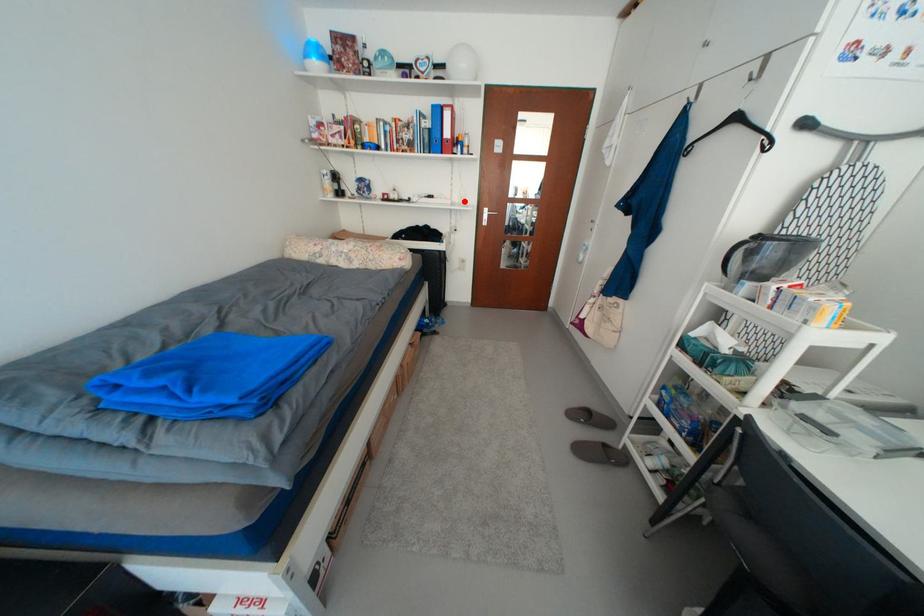
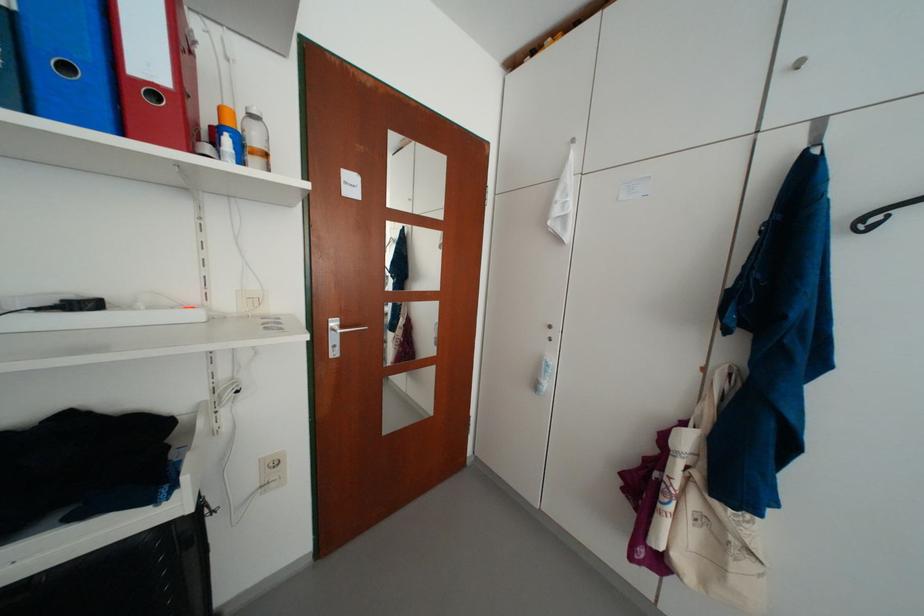
Locate, in the second image, the point that corresponds to the highlighted location in the first image.

(236, 306)